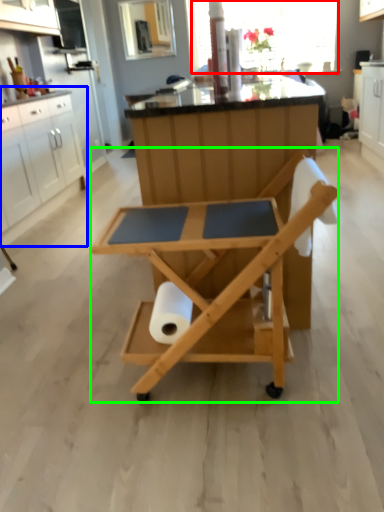
Question: Estimate the real-world distances between objects in this image. Which object is closer to window screen (highlighted by a red box), cabinetry (highlighted by a blue box) or table (highlighted by a green box)?

Choices:
 (A) cabinetry
 (B) table

Answer: (A)